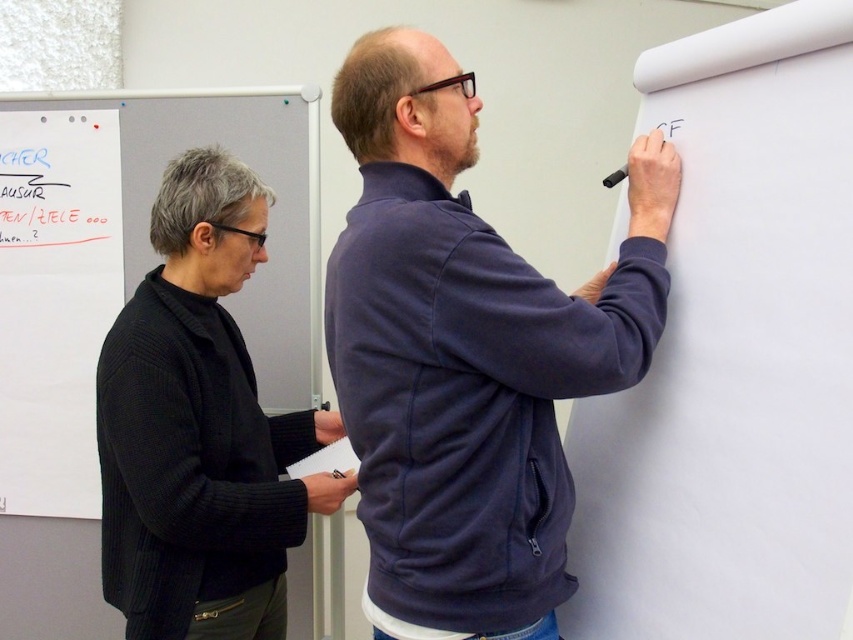
Question: Which object appears closest to the camera in this image?

Choices:
 (A) navy blue zip-up sweater at center
 (B) black matte pen at upper right
 (C) dark blue fleece jacket at center
 (D) red marker writing at upper left

Answer: (A)

Question: Is navy blue zip-up sweater at center wider than dark blue fleece jacket at center?

Choices:
 (A) no
 (B) yes

Answer: (B)

Question: Is white matte bulletin board at upper left above dark blue fleece jacket at center?

Choices:
 (A) no
 (B) yes

Answer: (B)

Question: In this image, where is navy blue zip-up sweater at center located relative to black matte pen at upper right?

Choices:
 (A) left
 (B) right

Answer: (A)

Question: Which point appears closest to the camera in this image?

Choices:
 (A) [x=701, y=40]
 (B) [x=82, y=196]
 (C) [x=238, y=170]
 (D) [x=7, y=339]

Answer: (A)

Question: Among these points, which one is nearest to the camera?

Choices:
 (A) (817, 92)
 (B) (674, 120)
 (C) (527, 564)
 (D) (201, 474)

Answer: (A)